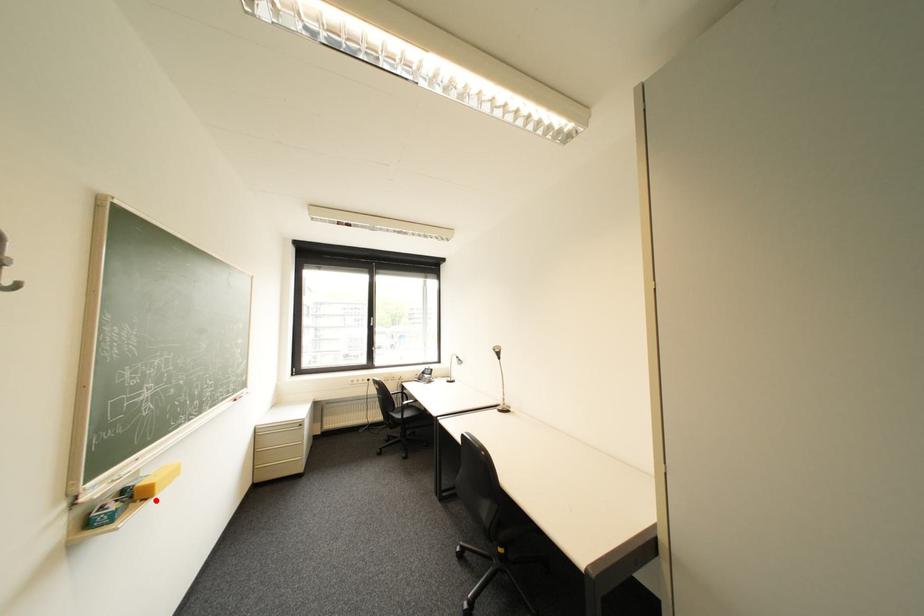
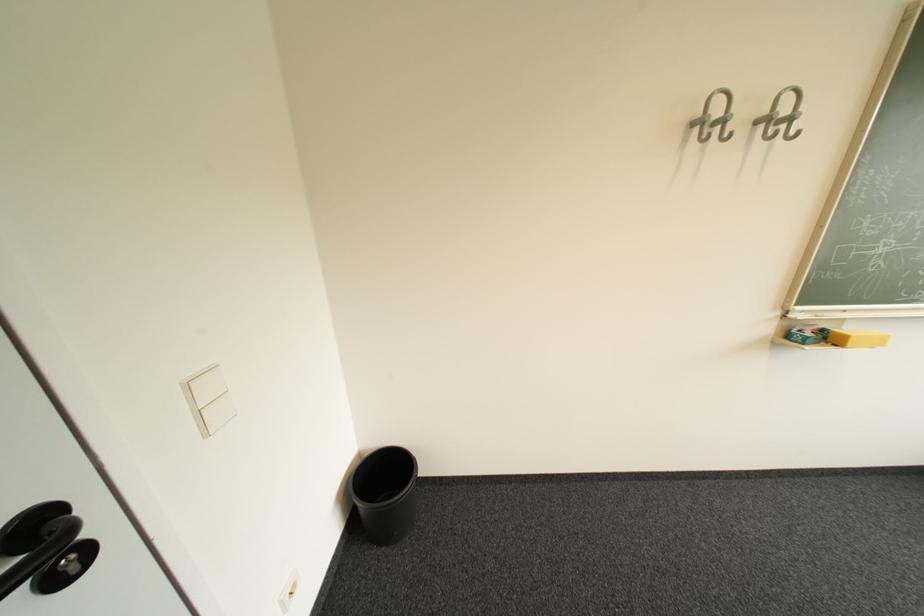
Locate, in the second image, the point that corresponds to the highlighted location in the first image.

(846, 346)